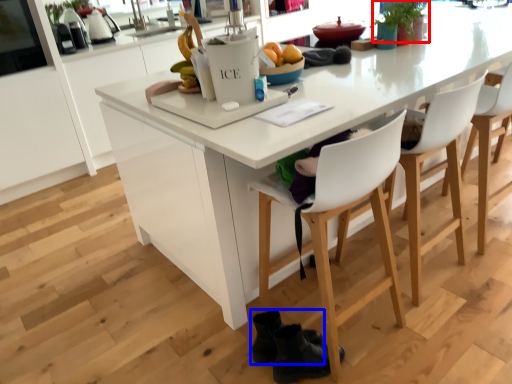
Question: Which of the following is the farthest to the observer, plant (highlighted by a red box) or footwear (highlighted by a blue box)?

Choices:
 (A) plant
 (B) footwear

Answer: (A)